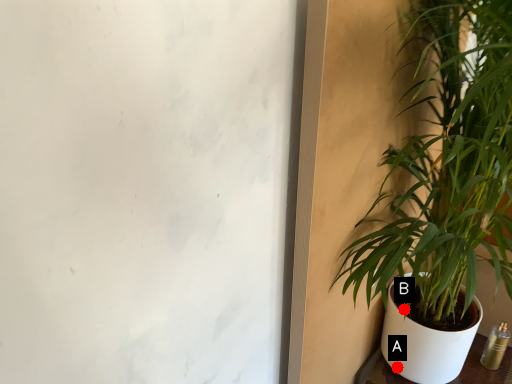
Question: Two points are circled on the image, labeled by A and B beside each circle. Among these points, which one is farthest from the camera?

Choices:
 (A) A is further
 (B) B is further

Answer: (A)